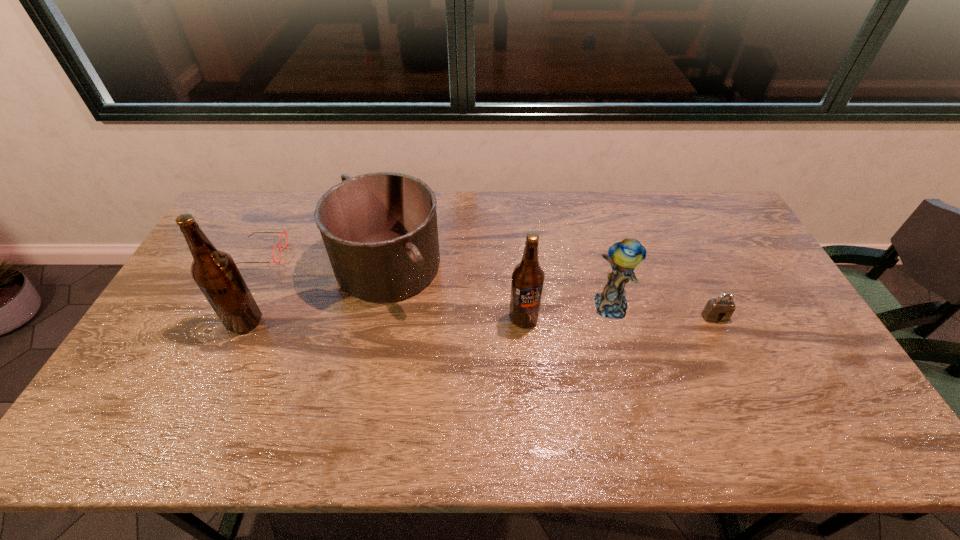
Locate an element on the screen. This screenshot has height=540, width=960. vacant space at the far edge of the desktop is located at coordinates (521, 196).

The image size is (960, 540). Find the location of `free region at the near edge of the desktop`. free region at the near edge of the desktop is located at coordinates (348, 377).

You are a GUI agent. You are given a task and a screenshot of the screen. Output one action in this format:
    pyautogui.click(x=<x>, y=<y>)
    Task: Click on the vacant space at the left edge of the desktop
    The image size is (960, 540).
    Given the screenshot: What is the action you would take?
    pyautogui.click(x=220, y=246)

At what (x,y) coordinates should I click in order to perform the action: click on vacant area at the right edge. Please return your answer as a coordinate pair (x, y). Looking at the image, I should click on (732, 239).

You are a GUI agent. You are given a task and a screenshot of the screen. Output one action in this format:
    pyautogui.click(x=<x>, y=<y>)
    Task: Click on the free space that is in between the rightmost object and the pan
    The width and height of the screenshot is (960, 540).
    Given the screenshot: What is the action you would take?
    pyautogui.click(x=551, y=291)

What are the coordinates of `free area in between the spectacles and the taller beer bottle` in the screenshot? It's located at (253, 288).

Locate an element on the screen. vacant area between the fourth object from left to right and the third shortest object is located at coordinates (456, 292).

Locate an element on the screen. This screenshot has width=960, height=540. unoccupied area between the tallest object and the parrot is located at coordinates (428, 314).

Locate an element on the screen. The height and width of the screenshot is (540, 960). blank region between the left beer bottle and the shortest object is located at coordinates (253, 288).

Locate an element on the screen. The height and width of the screenshot is (540, 960). vacant region between the right beer bottle and the taller beer bottle is located at coordinates [x=384, y=320].